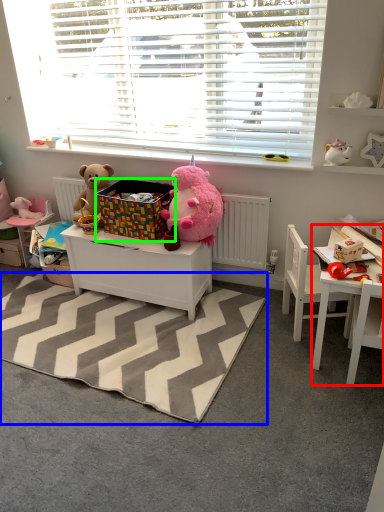
Question: Based on their relative distances, which object is nearer to table (highlighted by a red box)? Choose from mat (highlighted by a blue box) and crate (highlighted by a green box).

Choices:
 (A) mat
 (B) crate

Answer: (A)